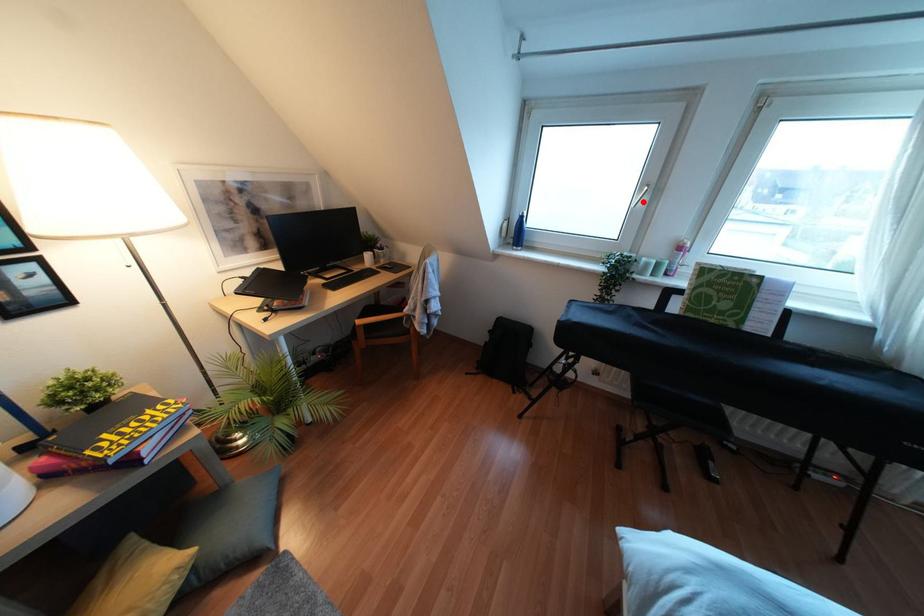
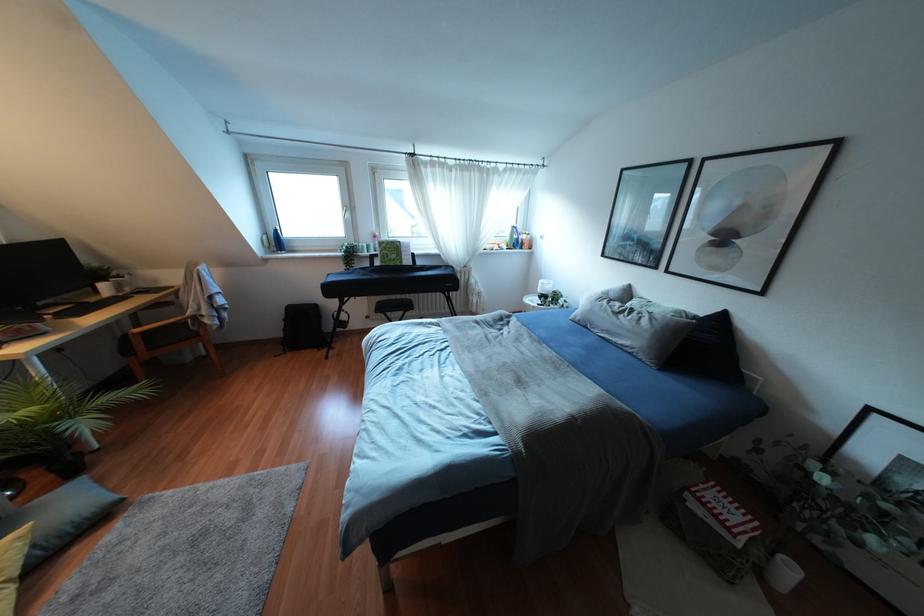
In the second image, find the point that corresponds to the highlighted location in the first image.

(346, 215)